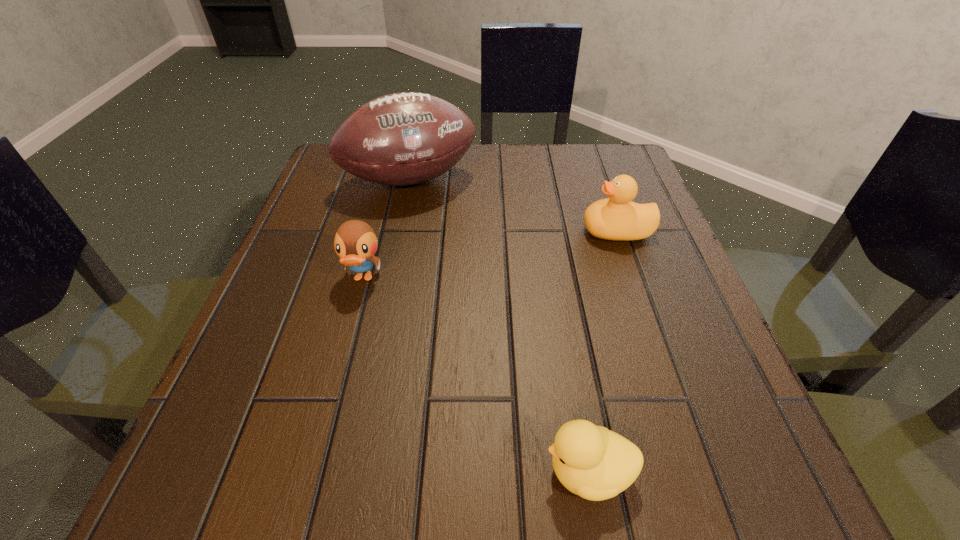
This screenshot has height=540, width=960. Identify the location of free point located 0.280m on the face of the farthest duck. (442, 231).

I want to click on vacant space located 0.110m on the face of the farthest duck, so click(527, 231).

Locate an element on the screen. This screenshot has width=960, height=540. vacant space positioned on the front-facing side of the second farthest duck is located at coordinates (301, 513).

Locate an element on the screen. The height and width of the screenshot is (540, 960). blank space located 0.100m on the front-facing side of the second duck from right to left is located at coordinates (463, 471).

Where is `vacant space located 0.390m on the front-facing side of the second duck from right to left`? vacant space located 0.390m on the front-facing side of the second duck from right to left is located at coordinates (228, 471).

The image size is (960, 540). I want to click on vacant area situated 0.260m on the front-facing side of the second duck from right to left, so click(x=333, y=471).

You are a GUI agent. You are given a task and a screenshot of the screen. Output one action in this format:
    pyautogui.click(x=<x>, y=<y>)
    Task: Click on the object that is positioned at the far edge
    
    Given the screenshot: What is the action you would take?
    pyautogui.click(x=407, y=138)

At what (x,y) coordinates should I click in order to perform the action: click on object present at the near edge. Please return your answer as a coordinate pair (x, y). The image size is (960, 540). Looking at the image, I should click on (593, 462).

Where is `football (American) present at the left edge`? football (American) present at the left edge is located at coordinates (407, 138).

The height and width of the screenshot is (540, 960). I want to click on duck at the left edge, so click(x=355, y=242).